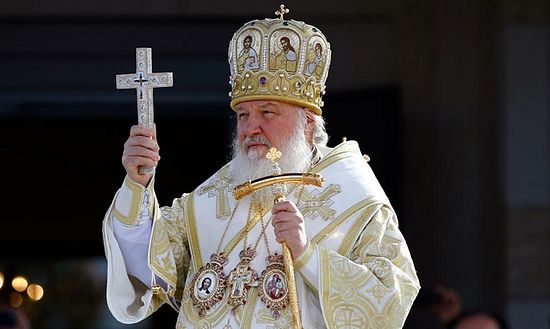
The height and width of the screenshot is (329, 550). In order to click on sash in this screenshot , I will do [x=324, y=232].